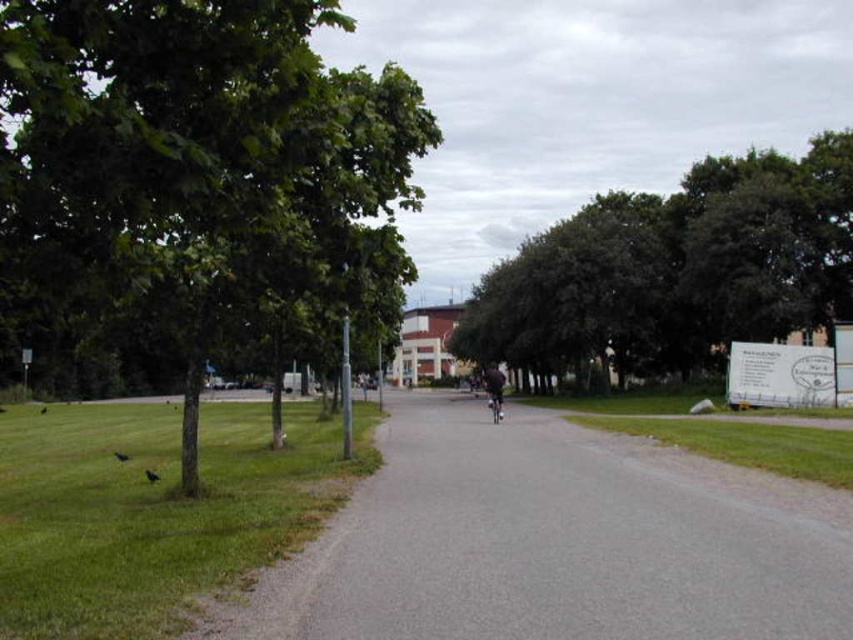
You are a gardener who needs to mow the green grass at lower left and also wants to move the shiny metallic bicycle at center to another location. Given the space available, can you move the bicycle without disturbing the grass?

The green grass at lower left is wider than the shiny metallic bicycle at center, so yes, you can move the bicycle without disturbing the grass since there is enough space.

You are a gardener who needs to mow the green grass at lower left. However, there is a dark fabric bicycle at center in the way. Can you mow the grass easily?

The green grass at lower left is positioned under the dark fabric bicycle at center, so the bicycle is blocking access to the grass. You will need to move the bicycle before mowing.

You are planning to set up a small picnic area in the scene. Given the presence of the green grass at lower left and the shiny metallic bicycle at center, which location would be more suitable for placing a picnic blanket without obstructing the bicycle?

The green grass at lower left is more suitable because it has a larger size compared to the shiny metallic bicycle at center, providing enough space for the picnic blanket without blocking the bicycle.